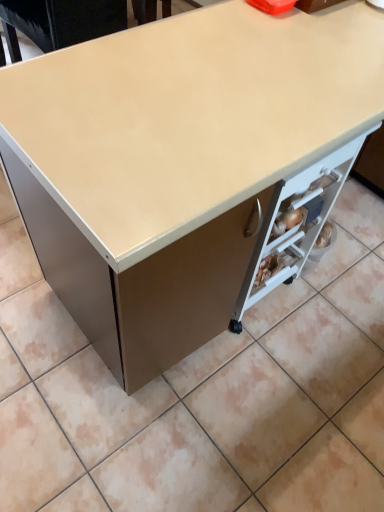
At what (x,y) coordinates should I click in order to perform the action: click on vacant space in front of matte white drawer at lower right. Please return your answer as a coordinate pair (x, y). The image size is (384, 512). Looking at the image, I should click on (263, 356).